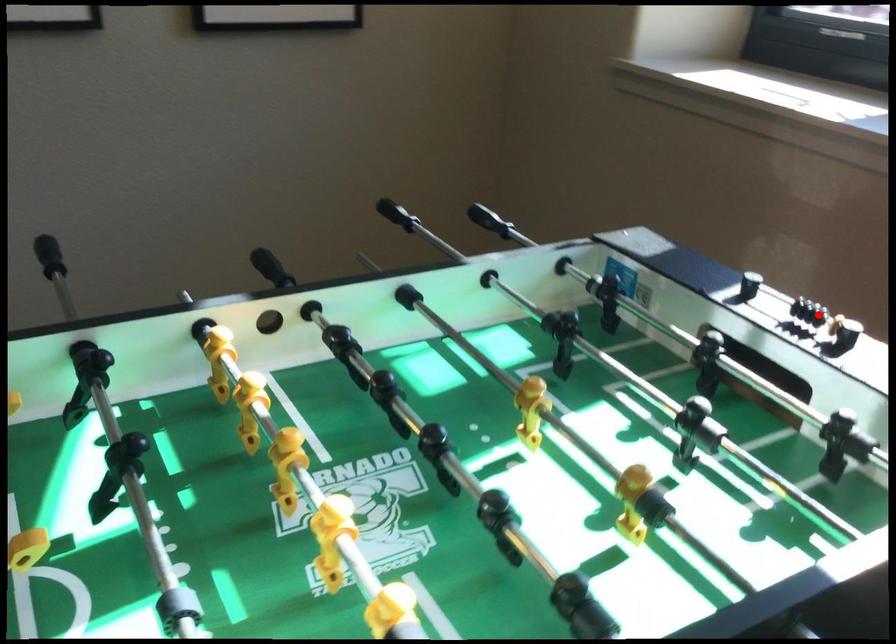
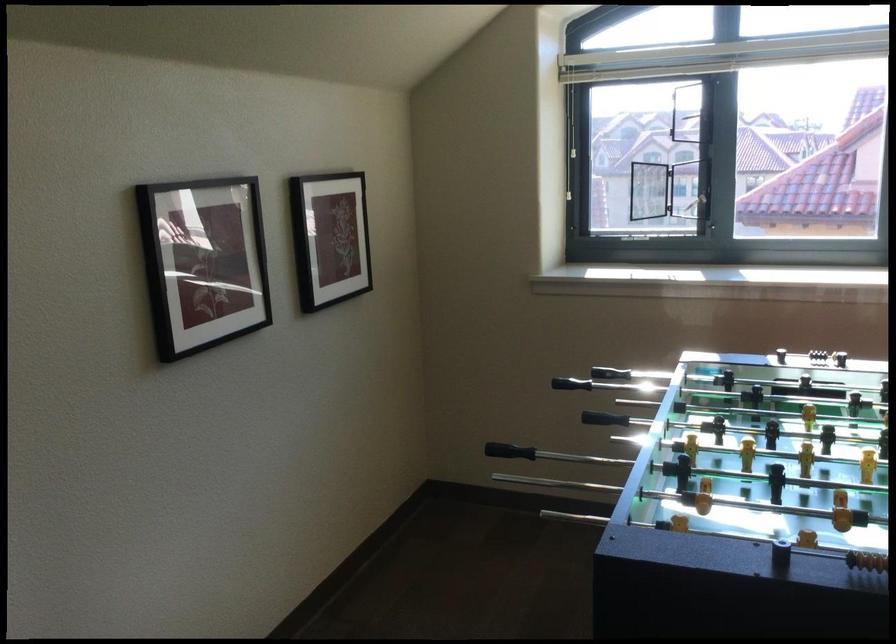
Where in the second image is the point corresponding to the highlighted location from the first image?

(815, 351)